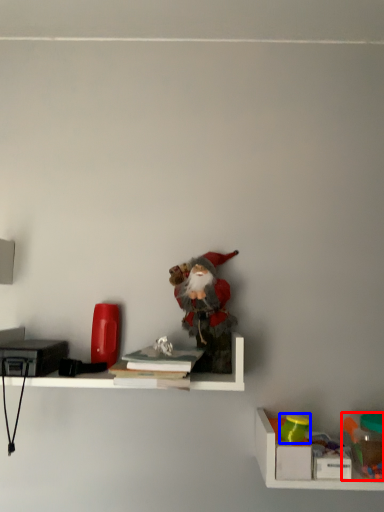
Question: Which object is closer to the camera taking this photo, toy (highlighted by a red box) or toy (highlighted by a blue box)?

Choices:
 (A) toy
 (B) toy

Answer: (A)